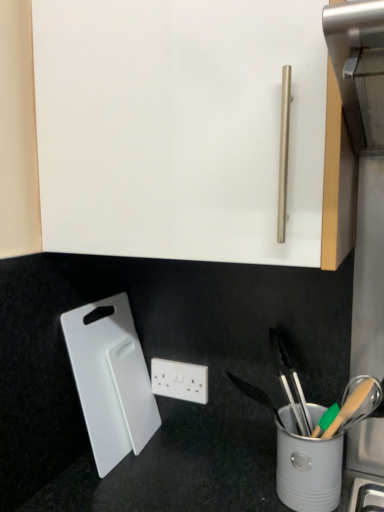
Question: Is white plastic cutting board at lower left to the right of white plastic power plugs and sockets at center from the viewer's perspective?

Choices:
 (A) yes
 (B) no

Answer: (B)

Question: From the image's perspective, is white plastic cutting board at lower left located above white plastic power plugs and sockets at center?

Choices:
 (A) no
 (B) yes

Answer: (B)

Question: Is white plastic cutting board at lower left to the left of white plastic power plugs and sockets at center from the viewer's perspective?

Choices:
 (A) yes
 (B) no

Answer: (A)

Question: Is white plastic cutting board at lower left taller than white plastic power plugs and sockets at center?

Choices:
 (A) no
 (B) yes

Answer: (B)

Question: Is there a large distance between white plastic cutting board at lower left and white plastic power plugs and sockets at center?

Choices:
 (A) yes
 (B) no

Answer: (B)

Question: Does white plastic cutting board at lower left have a greater width compared to white plastic power plugs and sockets at center?

Choices:
 (A) yes
 (B) no

Answer: (A)

Question: Is white plastic power plugs and sockets at center to the right of white plastic cutting board at lower left from the viewer's perspective?

Choices:
 (A) yes
 (B) no

Answer: (A)

Question: Could you tell me if white plastic power plugs and sockets at center is turned towards white plastic cutting board at lower left?

Choices:
 (A) no
 (B) yes

Answer: (B)

Question: Does white plastic power plugs and sockets at center have a smaller size compared to white plastic cutting board at lower left?

Choices:
 (A) yes
 (B) no

Answer: (A)

Question: Would you consider white plastic power plugs and sockets at center to be distant from white plastic cutting board at lower left?

Choices:
 (A) no
 (B) yes

Answer: (A)

Question: Does white plastic power plugs and sockets at center touch white plastic cutting board at lower left?

Choices:
 (A) no
 (B) yes

Answer: (A)

Question: Can you confirm if white plastic power plugs and sockets at center is thinner than white plastic cutting board at lower left?

Choices:
 (A) no
 (B) yes

Answer: (B)

Question: Based on their sizes in the image, would you say white plastic power plugs and sockets at center is bigger or smaller than white plastic cutting board at lower left?

Choices:
 (A) small
 (B) big

Answer: (A)